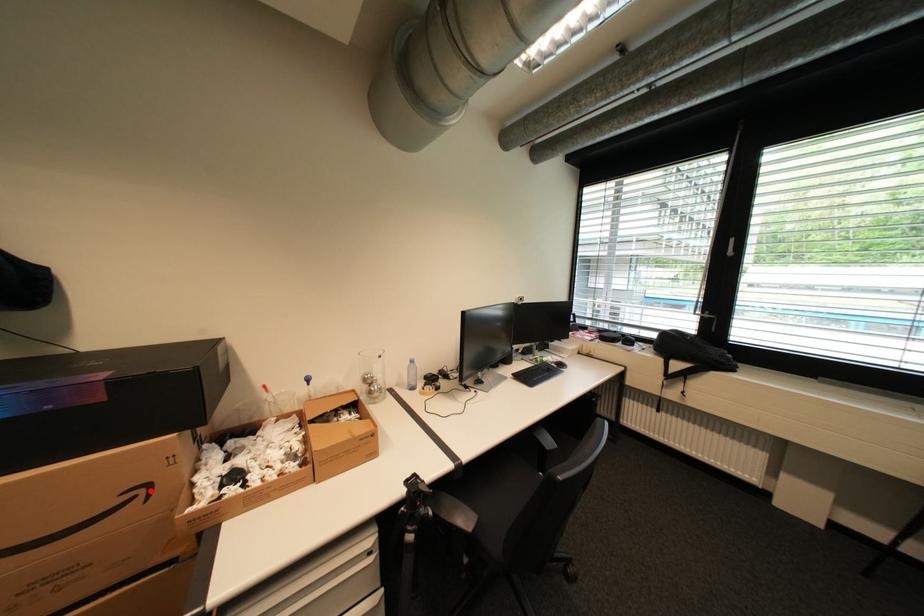
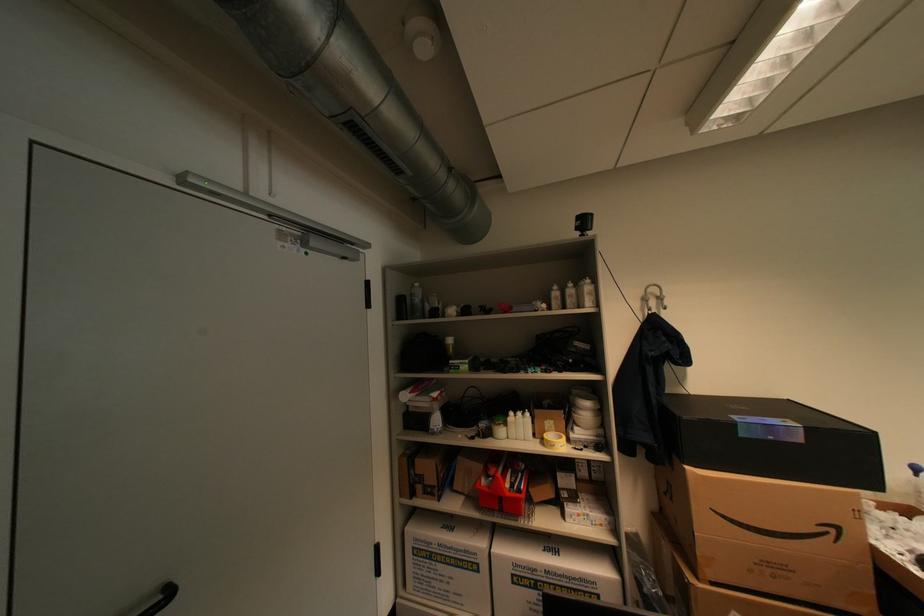
The point at the highlighted location is marked in the first image. Where is the corresponding point in the second image?

(841, 531)